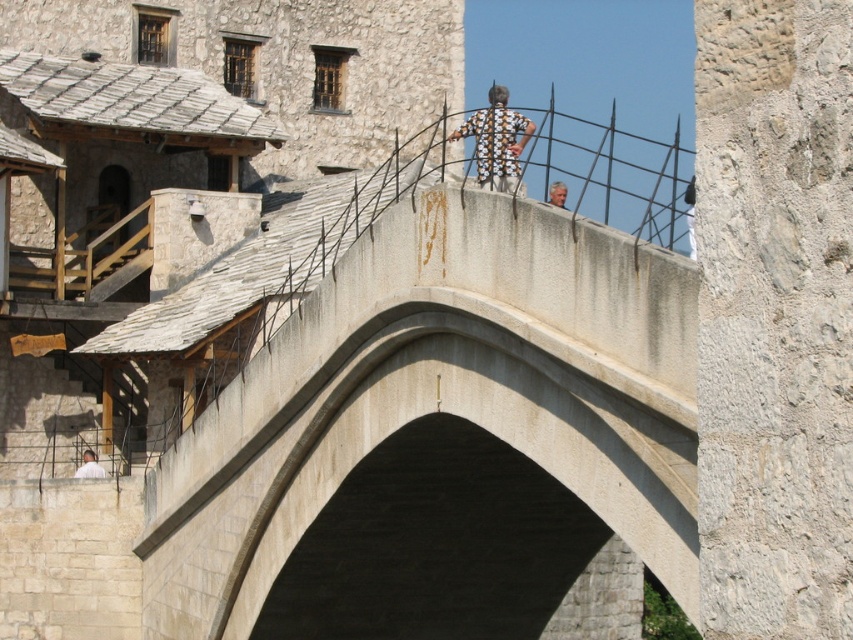
Does printed fabric shirt at center appear on the left side of light brown hair at upper center?

Correct, you'll find printed fabric shirt at center to the left of light brown hair at upper center.

Is printed fabric shirt at center closer to camera compared to light brown hair at upper center?

No, printed fabric shirt at center is further to the viewer.

Describe the element at coordinates (496, 140) in the screenshot. I see `printed fabric shirt at center` at that location.

Locate an element on the screen. The width and height of the screenshot is (853, 640). printed fabric shirt at center is located at coordinates (496, 140).

Does smooth concrete bridge at center appear on the left side of light brown hair at upper center?

Yes, smooth concrete bridge at center is to the left of light brown hair at upper center.

Is smooth concrete bridge at center above light brown hair at upper center?

Actually, smooth concrete bridge at center is below light brown hair at upper center.

Where is `smooth concrete bridge at center`? smooth concrete bridge at center is located at coordinates (422, 420).

Can you confirm if printed fabric shirt at center is wider than light gray stone person at lower left?

Yes, printed fabric shirt at center is wider than light gray stone person at lower left.

From the picture: Is printed fabric shirt at center thinner than light gray stone person at lower left?

No.

What are the coordinates of `printed fabric shirt at center` in the screenshot? It's located at (496, 140).

The height and width of the screenshot is (640, 853). What are the coordinates of `printed fabric shirt at center` in the screenshot? It's located at (496, 140).